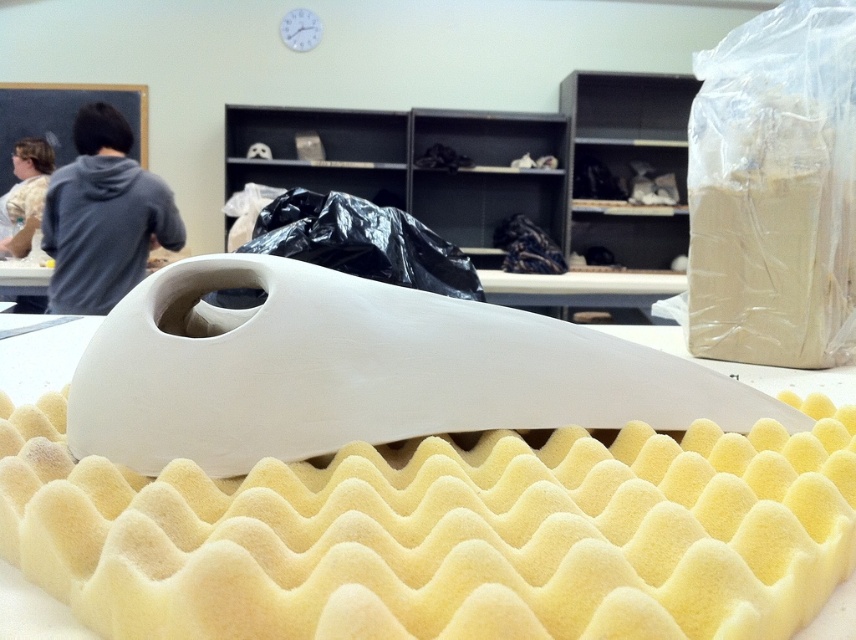
You are standing in the workspace and want to reach the point marked at coordinates (571, 445). If your arm can extend 15 inches, can you comfortably reach that point without moving your body?

The point at coordinates (571, 445) is 15.46 inches away from you. Since your arm can only extend 15 inches, you cannot comfortably reach it without moving your body.

You are organizing a classroom cleanup and need to place a black plastic bag at center. Where should you place it so it doesn not block the view of the gray hoodie at upper left?

Since the gray hoodie at upper left is above the black plastic bag at center, placing the black plastic bag at center lower than the gray hoodie at upper left will ensure it doesn not block the view.